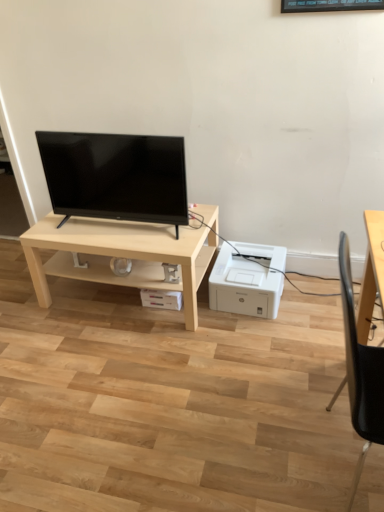
This screenshot has height=512, width=384. What are the coordinates of `empty space that is ontop of light wood table at center (from a real-world perspective)` in the screenshot? It's located at (116, 227).